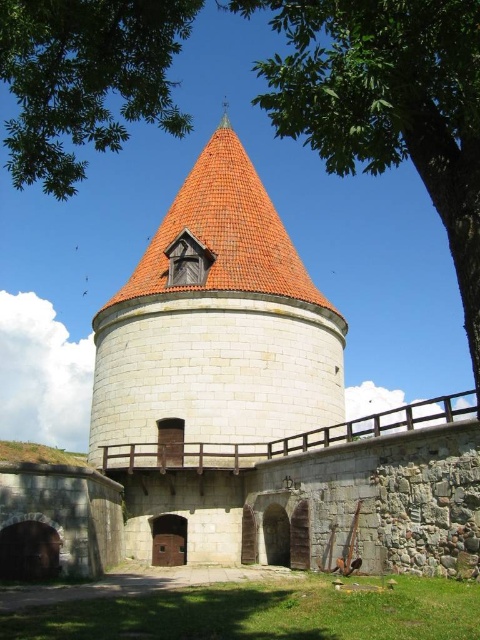
Is point (423, 42) behind point (157, 13)?

No, it is in front of (157, 13).

Between green leafy tree at upper center and green leafy tree at upper left, which one has less height?

Standing shorter between the two is green leafy tree at upper left.

Locate an element on the screen. The height and width of the screenshot is (640, 480). green leafy tree at upper center is located at coordinates (387, 104).